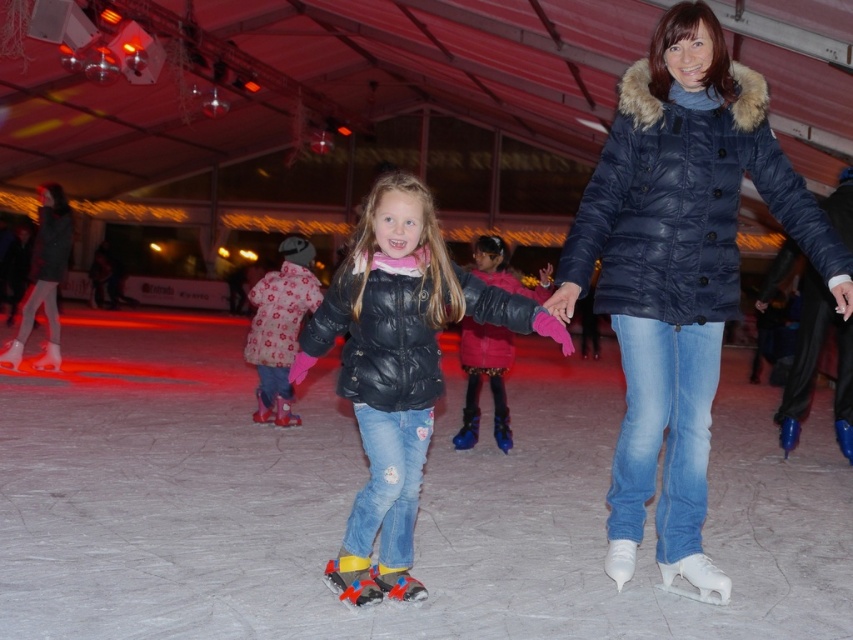
You are an ice skater standing at the edge of the white smooth ice at center. You want to skate to the other side of the rink, which is 10 meters away. If you can skate at a speed of 5 meters per second, how long will it take you to reach the other side?

To skate 10 meters at a speed of 5 meters per second, it will take 2 seconds.

Looking at this image, you are standing at the entrance of the ice skating rink and want to join the girl in her pink jacket. Which direction should you move relative to the white smooth ice at center to reach the velvet pink jacket at center?

To reach the velvet pink jacket at center from the white smooth ice at center, you should move to the right since the white smooth ice at center is positioned to the left of the velvet pink jacket at center.

You are an ice skater standing at the entrance of the rink. You see the white smooth ice at center and the fluffy pink snowsuit at center. Which object is located to the left of the other?

The white smooth ice at center is positioned on the right side of fluffy pink snowsuit at center, so the fluffy pink snowsuit at center is to the left of the white smooth ice at center.